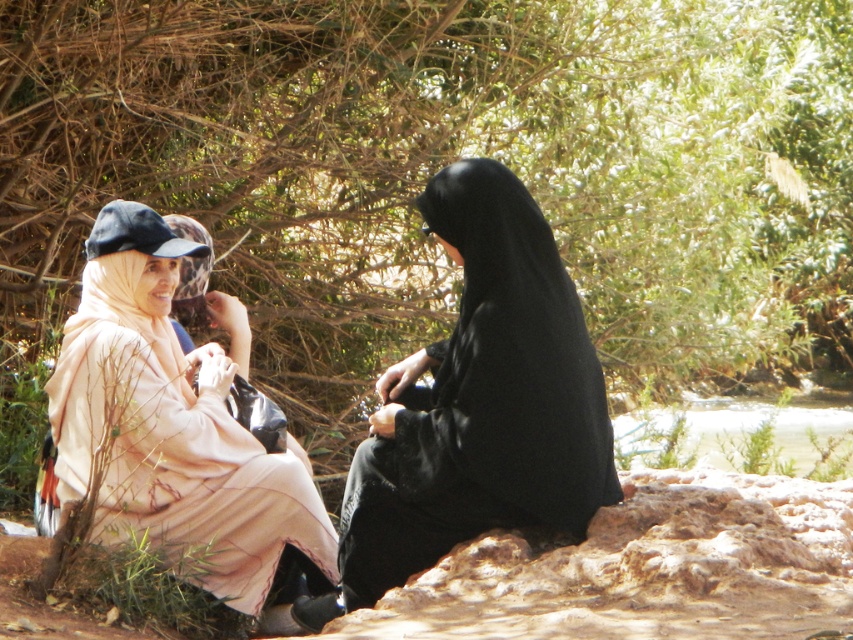
Question: Does brown textured tree at upper center have a smaller size compared to black matte dress at center?

Choices:
 (A) no
 (B) yes

Answer: (A)

Question: Which point is farther from the camera taking this photo?

Choices:
 (A) (71, 374)
 (B) (636, 436)
 (C) (540, 412)

Answer: (B)

Question: Which of the following is the closest to the observer?

Choices:
 (A) clear water at creek right
 (B) brown textured tree at upper center

Answer: (B)

Question: Which object appears farthest from the camera in this image?

Choices:
 (A) brown textured tree at upper center
 (B) clear water at creek right
 (C) black matte dress at center

Answer: (B)

Question: Does black matte dress at center appear on the left side of pale pink fabric at left?

Choices:
 (A) no
 (B) yes

Answer: (A)

Question: Can you confirm if black matte dress at center is smaller than clear water at creek right?

Choices:
 (A) yes
 (B) no

Answer: (A)